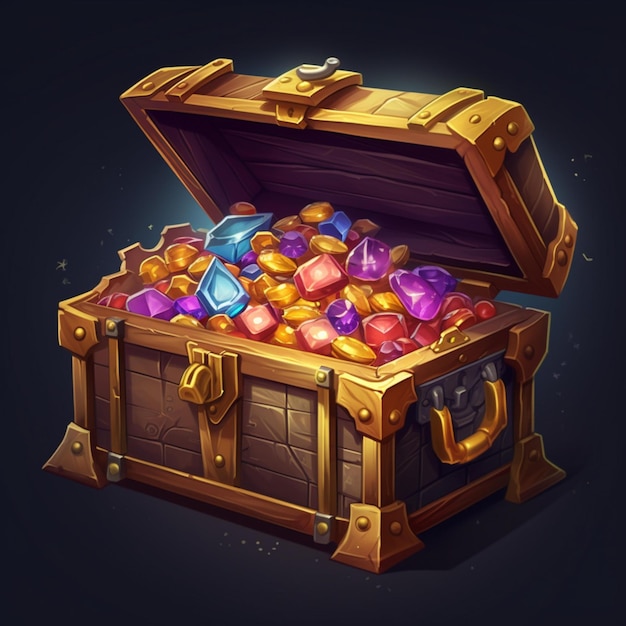
Identify the location of corner bumper. The height and width of the screenshot is (626, 626). (376, 401), (540, 332), (543, 463), (376, 550), (63, 329), (59, 452).